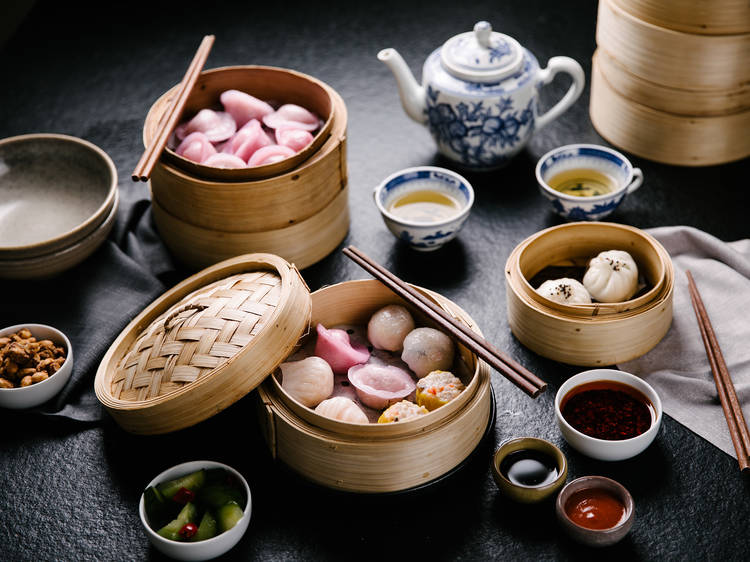
Locate an element on the screen. tea kettle is located at coordinates (476, 114).